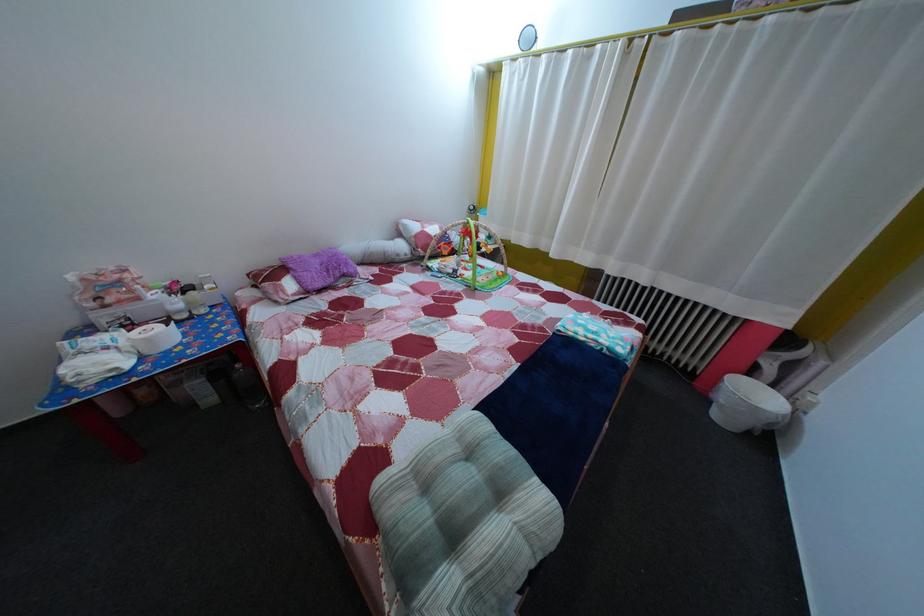
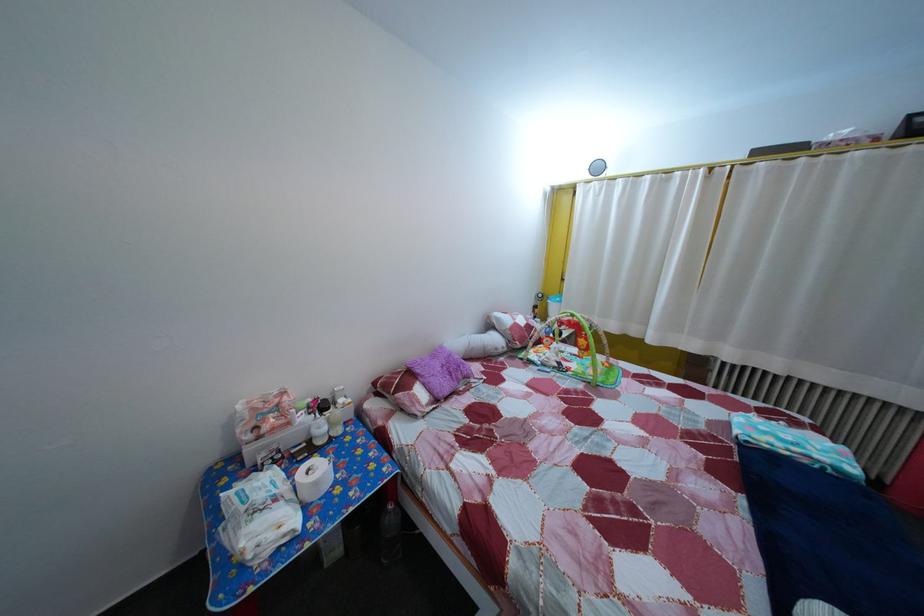
Find the pixel in the second image that matches [157,347] in the first image.

(325, 491)